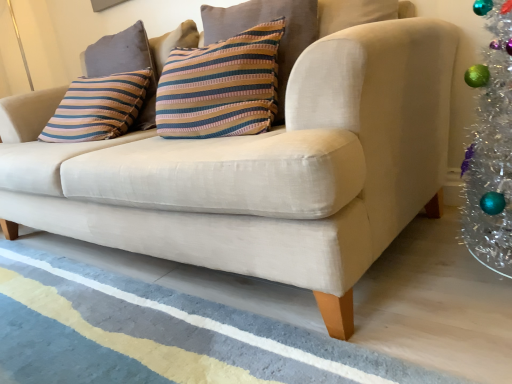
Question: Is striped fabric pillow at center, which appears as the first pillow when viewed from the front, positioned in front of blue textured rug at lower center?

Choices:
 (A) no
 (B) yes

Answer: (A)

Question: From a real-world perspective, is striped fabric pillow at center, which appears as the first pillow when viewed from the front, physically below blue textured rug at lower center?

Choices:
 (A) no
 (B) yes

Answer: (A)

Question: Is striped fabric pillow at center, which appears as the first pillow when viewed from the front, looking in the opposite direction of blue textured rug at lower center?

Choices:
 (A) yes
 (B) no

Answer: (B)

Question: Is striped fabric pillow at center, which appears as the first pillow when viewed from the front, at the left side of blue textured rug at lower center?

Choices:
 (A) yes
 (B) no

Answer: (B)

Question: From the image's perspective, is striped fabric pillow at center, the 2th pillow viewed from the left, beneath blue textured rug at lower center?

Choices:
 (A) yes
 (B) no

Answer: (B)

Question: From the image's perspective, is striped fabric pillow at center, which appears as the first pillow when viewed from the front, over striped fabric pillow at upper left, the 1th pillow positioned from the back?

Choices:
 (A) no
 (B) yes

Answer: (A)

Question: Does striped fabric pillow at center, which is the second pillow in back-to-front order, have a lesser width compared to striped fabric pillow at upper left, which is the 1th pillow in left-to-right order?

Choices:
 (A) no
 (B) yes

Answer: (A)

Question: Is striped fabric pillow at center, which appears as the first pillow when viewed from the front, to the left of striped fabric pillow at upper left, the second pillow positioned from the right, from the viewer's perspective?

Choices:
 (A) yes
 (B) no

Answer: (B)

Question: Does striped fabric pillow at center, acting as the first pillow starting from the right, have a smaller size compared to striped fabric pillow at upper left, which appears as the 2th pillow when viewed from the front?

Choices:
 (A) no
 (B) yes

Answer: (A)

Question: From a real-world perspective, is striped fabric pillow at center, which appears as the first pillow when viewed from the front, beneath striped fabric pillow at upper left, which is the 1th pillow in left-to-right order?

Choices:
 (A) yes
 (B) no

Answer: (A)

Question: Does striped fabric pillow at center, which appears as the first pillow when viewed from the front, have a greater height compared to striped fabric pillow at upper left, the 1th pillow positioned from the back?

Choices:
 (A) no
 (B) yes

Answer: (B)

Question: Does striped fabric pillow at upper left, which is the 1th pillow in left-to-right order, appear on the right side of blue textured rug at lower center?

Choices:
 (A) yes
 (B) no

Answer: (B)